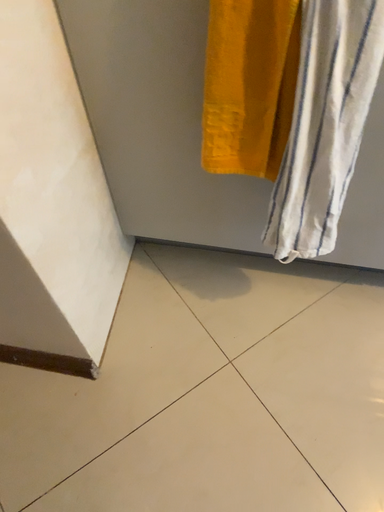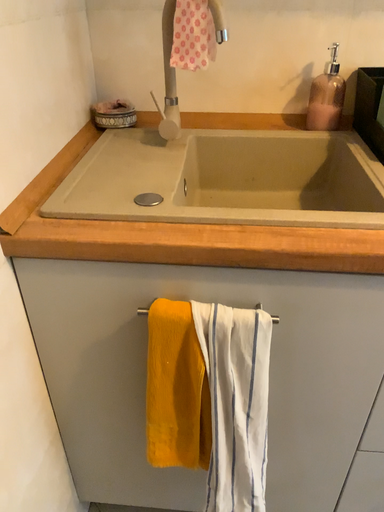
Question: Which way did the camera rotate in the video?

Choices:
 (A) rotated downward
 (B) rotated upward

Answer: (B)